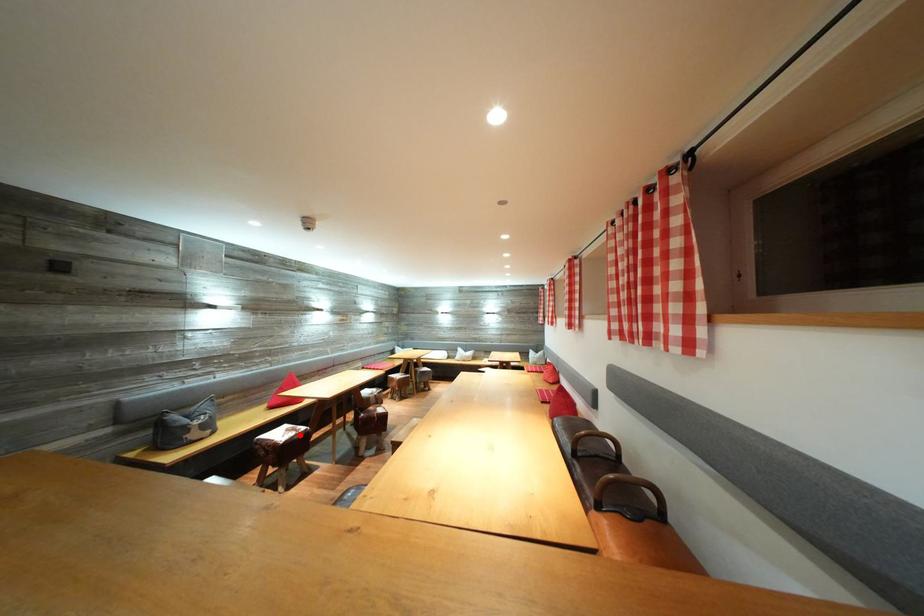
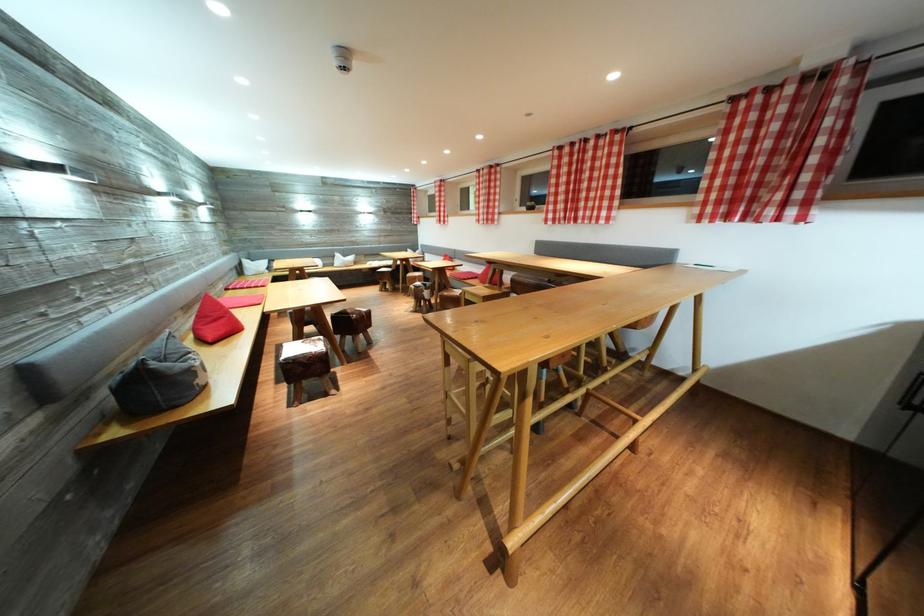
Locate, in the second image, the point that corresponds to the highlighted location in the first image.

(321, 346)